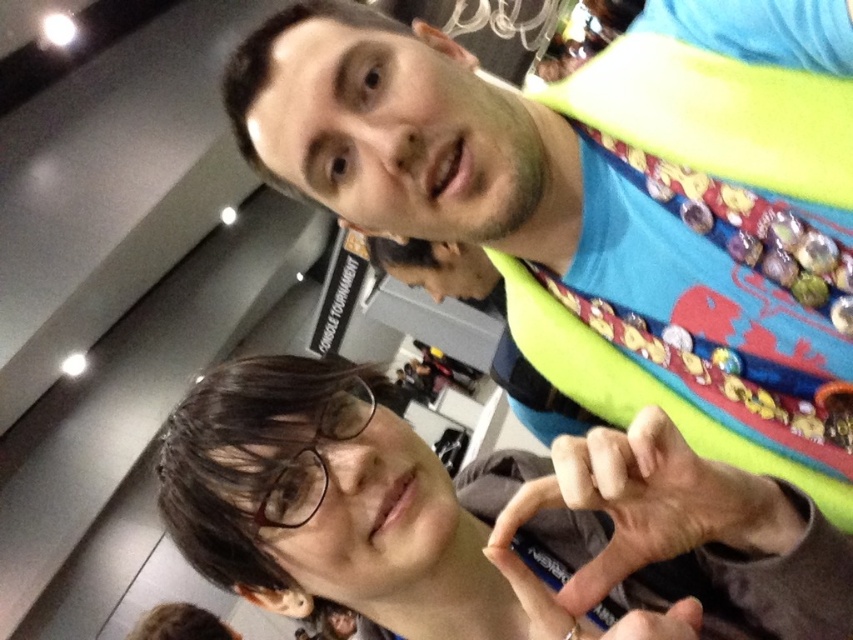
Which of these two, brown matte glasses at lower left or matte black pen at center, stands shorter?

Standing shorter between the two is matte black pen at center.

Is brown matte glasses at lower left smaller than matte black pen at center?

No, brown matte glasses at lower left is not smaller than matte black pen at center.

Who is more distant from viewer, (488, 467) or (550, 486)?

The point (488, 467) is behind.

Where is `brown matte glasses at lower left`? The image size is (853, 640). brown matte glasses at lower left is located at coordinates (485, 522).

Can you confirm if matte blue shirt at upper center is taller than brown matte glasses at lower left?

Indeed, matte blue shirt at upper center has a greater height compared to brown matte glasses at lower left.

Is point (659, 152) less distant than point (276, 374)?

No, it is not.

You are a GUI agent. You are given a task and a screenshot of the screen. Output one action in this format:
    pyautogui.click(x=<x>, y=<y>)
    Task: Click on the matte blue shirt at upper center
    The width and height of the screenshot is (853, 640).
    Given the screenshot: What is the action you would take?
    pyautogui.click(x=608, y=205)

You are a GUI agent. You are given a task and a screenshot of the screen. Output one action in this format:
    pyautogui.click(x=<x>, y=<y>)
    Task: Click on the matte blue shirt at upper center
    
    Given the screenshot: What is the action you would take?
    pyautogui.click(x=608, y=205)

Which is in front, point (850, 248) or point (744, 504)?

Point (744, 504)

Does matte blue shirt at upper center have a smaller size compared to matte black pen at center?

No, matte blue shirt at upper center is not smaller than matte black pen at center.

Is point (581, 188) closer to viewer compared to point (625, 472)?

No, it is not.

The height and width of the screenshot is (640, 853). In order to click on matte blue shirt at upper center in this screenshot , I will do `click(608, 205)`.